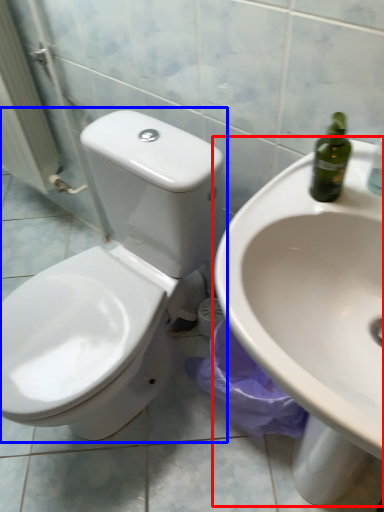
Question: Which point is further to the camera, sink (highlighted by a red box) or toilet (highlighted by a blue box)?

Choices:
 (A) sink
 (B) toilet

Answer: (B)